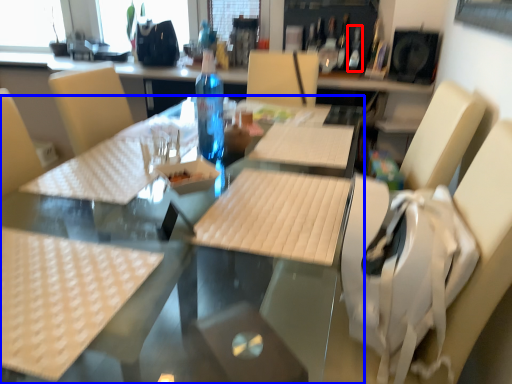
Question: Which of the following is the farthest to the observer, bottle (highlighted by a red box) or table (highlighted by a blue box)?

Choices:
 (A) bottle
 (B) table

Answer: (A)